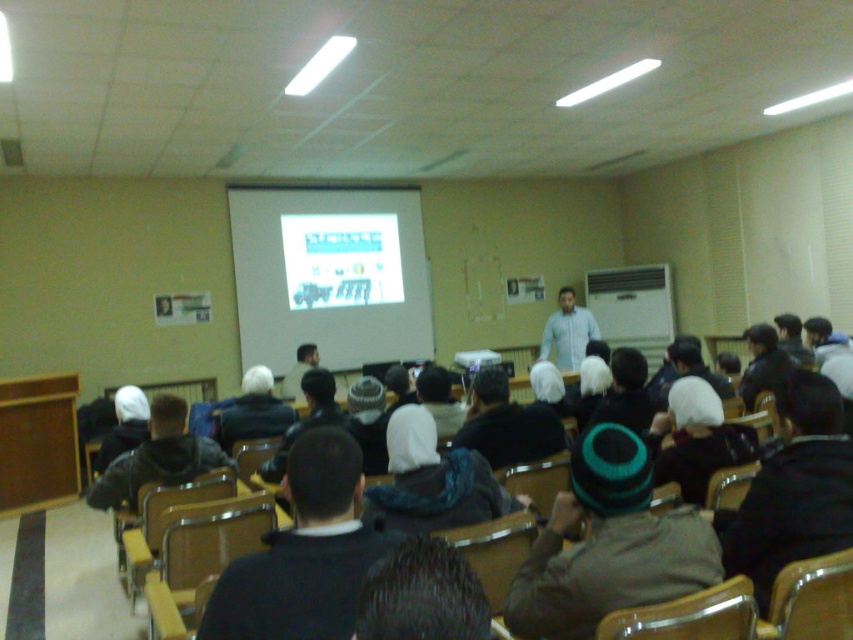
You are an attendee sitting in the back row of the classroom. You want to see the slide on the projector screen at the front clearly. Which object, the dark gray knit cap at center or the dark blue jacket at center, is less likely to block your view?

The dark gray knit cap at center is shorter than the dark blue jacket at center, so the dark gray knit cap at center is less likely to block your view.

You are a photographer standing at the back of the classroom. You want to take a photo of both the green knitted hat at lower center and the dark gray knit cap at lower right in the same frame. The camera you have can capture objects within a 24 inch range. Can both objects fit in the frame?

The green knitted hat at lower center and dark gray knit cap at lower right are 20.42 inches apart from each other. Since the camera can capture objects within a 24 inch range, both objects can fit in the frame as 20.42 is less than 24.

You are standing at the entrance of the classroom and want to locate the dark blue hoodie at center. Based on the coordinates provided, where should you look relative to the classroom entrance?

The dark blue hoodie at center is located at coordinates point [305,419]. Since the entrance is typically at the front of the classroom, the dark blue hoodie at center is positioned towards the back right area of the classroom.